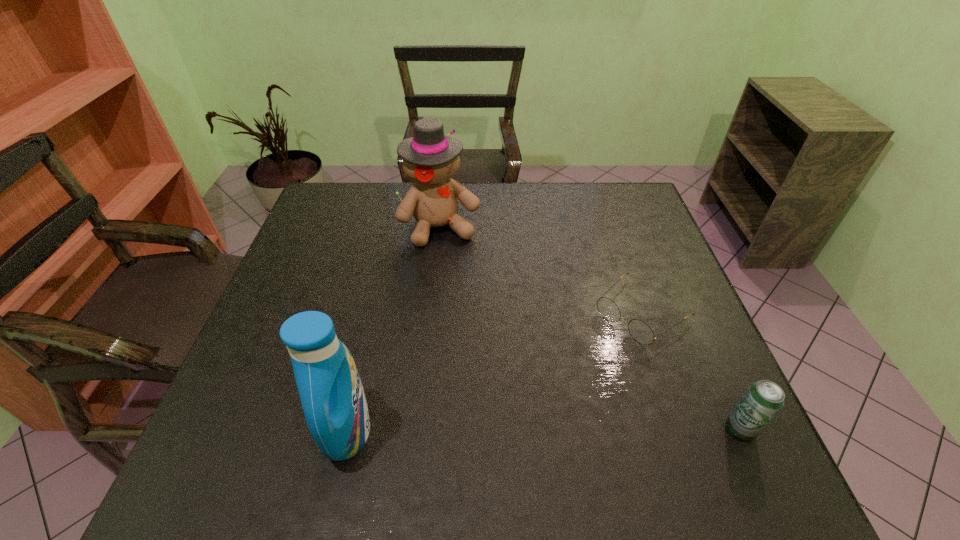
I want to click on detergent, so click(x=331, y=392).

Locate an element on the screen. This screenshot has height=540, width=960. the second shortest object is located at coordinates (763, 400).

The image size is (960, 540). In order to click on the third nearest object in this screenshot , I will do `click(640, 331)`.

Where is `the shortest object`? The width and height of the screenshot is (960, 540). the shortest object is located at coordinates (640, 331).

Locate an element on the screen. This screenshot has width=960, height=540. rag_doll is located at coordinates (430, 158).

This screenshot has height=540, width=960. In order to click on free space located on the front-facing side of the detergent in this screenshot , I will do click(x=481, y=430).

At what (x,y) coordinates should I click in order to perform the action: click on blank area located on the left of the second shortest object. Please return your answer as a coordinate pair (x, y). The height and width of the screenshot is (540, 960). Looking at the image, I should click on (689, 430).

Find the location of `vacant space situated 0.210m on the temples of the spectacles`. vacant space situated 0.210m on the temples of the spectacles is located at coordinates (552, 388).

Find the location of a particular element. The width and height of the screenshot is (960, 540). vacant space situated on the temples of the spectacles is located at coordinates (559, 383).

You are a GUI agent. You are given a task and a screenshot of the screen. Output one action in this format:
    pyautogui.click(x=<x>, y=<y>)
    Task: Click on the vacant space located on the temples of the spectacles
    
    Given the screenshot: What is the action you would take?
    pyautogui.click(x=529, y=407)